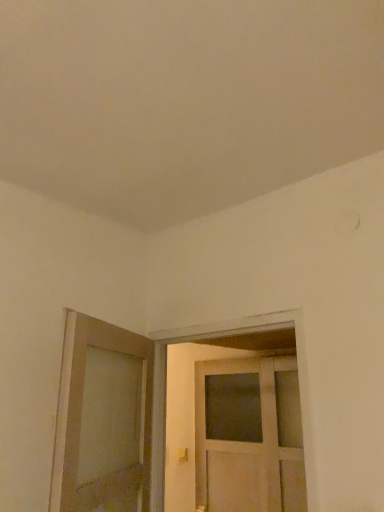
Question: From the image's perspective, is matte wooden door at left, which is the 1th door in left-to-right order, over white wooden door at center, placed as the second door when sorted from left to right?

Choices:
 (A) yes
 (B) no

Answer: (A)

Question: Does matte wooden door at left, which is the second door from right to left, come behind white wooden door at center, placed as the second door when sorted from left to right?

Choices:
 (A) no
 (B) yes

Answer: (A)

Question: Does matte wooden door at left, which is the second door from right to left, have a lesser height compared to white wooden door at center, the first door in the right-to-left sequence?

Choices:
 (A) yes
 (B) no

Answer: (A)

Question: Is there a large distance between matte wooden door at left, which is the second door from right to left, and white wooden door at center, placed as the second door when sorted from left to right?

Choices:
 (A) no
 (B) yes

Answer: (A)

Question: Could white wooden door at center, the first door in the right-to-left sequence, be considered to be inside matte wooden door at left, which is the second door from right to left?

Choices:
 (A) yes
 (B) no

Answer: (B)

Question: From a real-world perspective, is matte gold door handle at lower center above or below matte wooden door at left, which is the 1th door in left-to-right order?

Choices:
 (A) above
 (B) below

Answer: (B)

Question: Does point (182, 455) appear closer or farther from the camera than point (147, 344)?

Choices:
 (A) closer
 (B) farther

Answer: (B)

Question: Is matte gold door handle at lower center wider or thinner than matte wooden door at left, which is the second door from right to left?

Choices:
 (A) thin
 (B) wide

Answer: (A)

Question: Considering the relative positions of matte gold door handle at lower center and matte wooden door at left, which is the 1th door in left-to-right order, in the image provided, is matte gold door handle at lower center to the left or to the right of matte wooden door at left, which is the 1th door in left-to-right order,?

Choices:
 (A) right
 (B) left

Answer: (A)

Question: In the image, is matte gold door handle at lower center positioned in front of or behind white wooden door at center, the first door in the right-to-left sequence?

Choices:
 (A) front
 (B) behind

Answer: (B)

Question: In terms of size, does matte gold door handle at lower center appear bigger or smaller than white wooden door at center, the first door in the right-to-left sequence?

Choices:
 (A) big
 (B) small

Answer: (B)

Question: Is point (183, 459) positioned closer to the camera than point (82, 362)?

Choices:
 (A) closer
 (B) farther

Answer: (B)

Question: Based on their positions, is matte gold door handle at lower center located to the left or right of white wooden door at center, placed as the second door when sorted from left to right?

Choices:
 (A) right
 (B) left

Answer: (B)

Question: Which is correct: matte wooden door at left, which is the second door from right to left, is inside white wooden door at center, the first door in the right-to-left sequence, or outside of it?

Choices:
 (A) outside
 (B) inside

Answer: (A)

Question: From the image's perspective, is matte wooden door at left, which is the second door from right to left, positioned above or below white wooden door at center, the first door in the right-to-left sequence?

Choices:
 (A) above
 (B) below

Answer: (A)